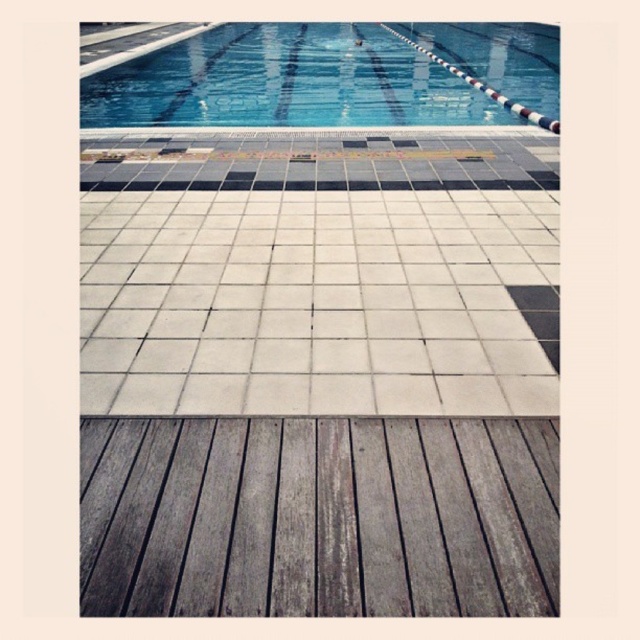
Is point (502, 508) more distant than point (122, 97)?

No, (502, 508) is in front of (122, 97).

Is gray weathered wood plank at center to the left of blue glossy water at upper center from the viewer's perspective?

Indeed, gray weathered wood plank at center is positioned on the left side of blue glossy water at upper center.

At what (x,y) coordinates should I click in order to perform the action: click on gray weathered wood plank at center. Please return your answer as a coordinate pair (x, y). Looking at the image, I should click on (317, 516).